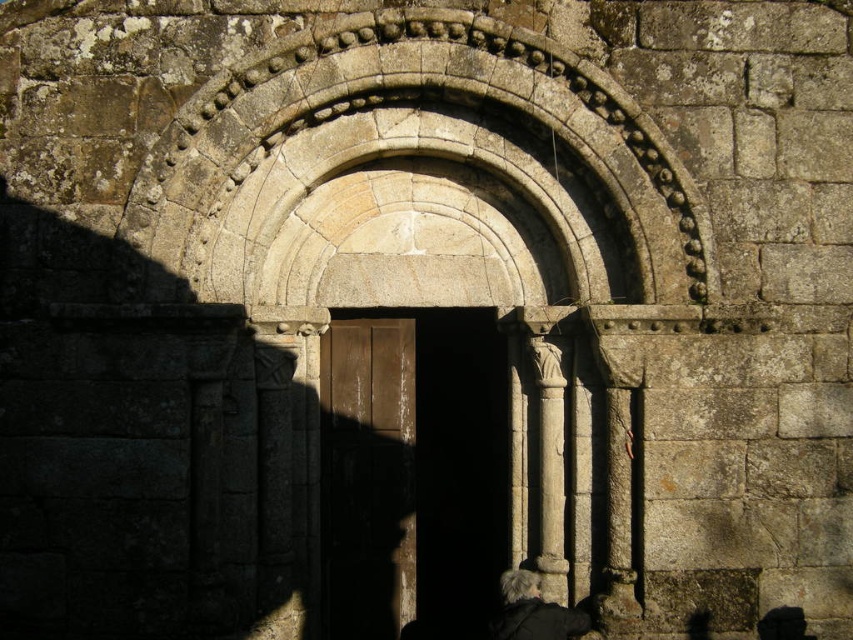
You are a painter standing in front of the historical stone doorway. You want to paint the smooth stone column at center and the dark gray wool coat at lower center. Which object should you focus on first if you want to paint the narrower one first?

A: The smooth stone column at center has a lesser width compared to the dark gray wool coat at lower center, so you should focus on painting the smooth stone column at center first since it is narrower.

You are a photographer standing in front of the historical stone doorway. You have two points marked on your camera screen at coordinates point (x=387, y=371) and point (x=541, y=380). Which point is closer to your camera lens?

Point (x=387, y=371) is further to the camera than point (x=541, y=380). Therefore, point (x=541, y=380) is closer to the camera lens.